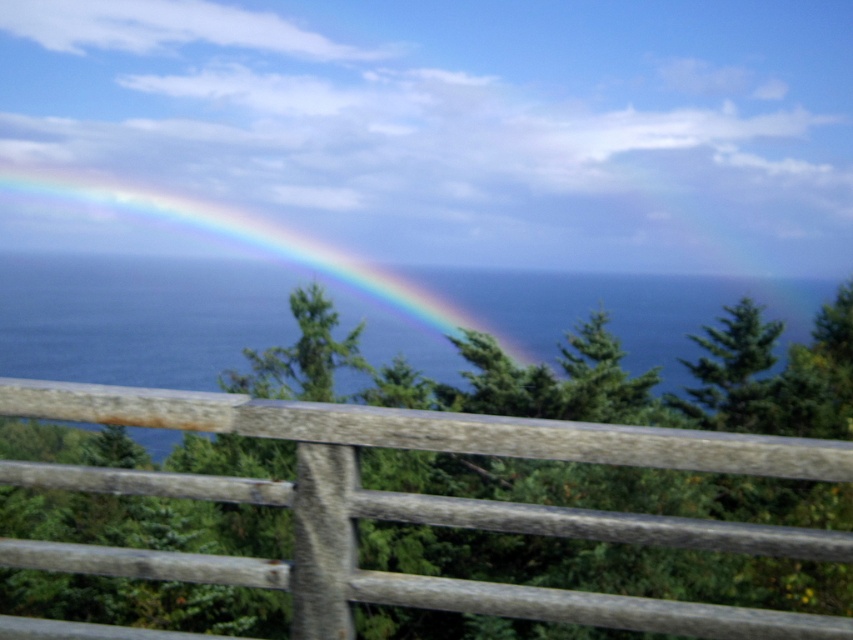
Between weathered wood fence at center and rainbow translucent at left, which one is positioned lower?

weathered wood fence at center

Does weathered wood fence at center have a lesser width compared to rainbow translucent at left?

Yes.

Between point (9, 412) and point (33, 307), which one is positioned behind?

Positioned behind is point (33, 307).

Where is `weathered wood fence at center`? This screenshot has width=853, height=640. weathered wood fence at center is located at coordinates (424, 506).

Is point (131, 330) positioned behind point (86, 355)?

Yes, it is.

Between blue water at center and rainbow translucent at left, which one is positioned higher?

rainbow translucent at left

Where is `blue water at center`? The height and width of the screenshot is (640, 853). blue water at center is located at coordinates (138, 317).

Where is `weathered wood fence at center`? This screenshot has width=853, height=640. weathered wood fence at center is located at coordinates (424, 506).